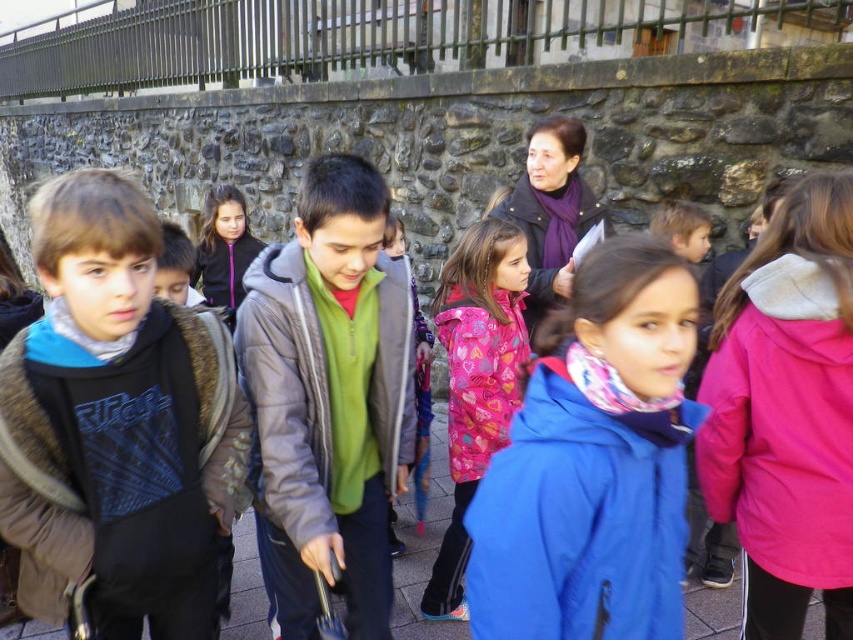
Which is above, brown fur-lined jacket at left or blue fleece jacket at center?

brown fur-lined jacket at left is higher up.

Can you confirm if brown fur-lined jacket at left is positioned to the left of blue fleece jacket at center?

Yes, brown fur-lined jacket at left is to the left of blue fleece jacket at center.

Which is in front, point (158, 550) or point (670, 269)?

Positioned in front is point (670, 269).

Image resolution: width=853 pixels, height=640 pixels. Identify the location of brown fur-lined jacket at left. (117, 424).

I want to click on blue fleece jacket at center, so click(x=595, y=461).

The image size is (853, 640). Describe the element at coordinates (595, 461) in the screenshot. I see `blue fleece jacket at center` at that location.

Who is more distant from viewer, [683,308] or [825,230]?

Positioned behind is point [825,230].

This screenshot has width=853, height=640. What are the coordinates of `blue fleece jacket at center` in the screenshot? It's located at (595, 461).

Between point (724, 522) and point (231, 612), which one is positioned in front?

Positioned in front is point (724, 522).

Can you confirm if pink fleece jacket at center is positioned to the right of blue fabric jacket at center?

Correct, you'll find pink fleece jacket at center to the right of blue fabric jacket at center.

Does point (708, 502) lie in front of point (418, 556)?

Yes, point (708, 502) is closer to viewer.

Identify the location of pink fleece jacket at center. The width and height of the screenshot is (853, 640). (786, 412).